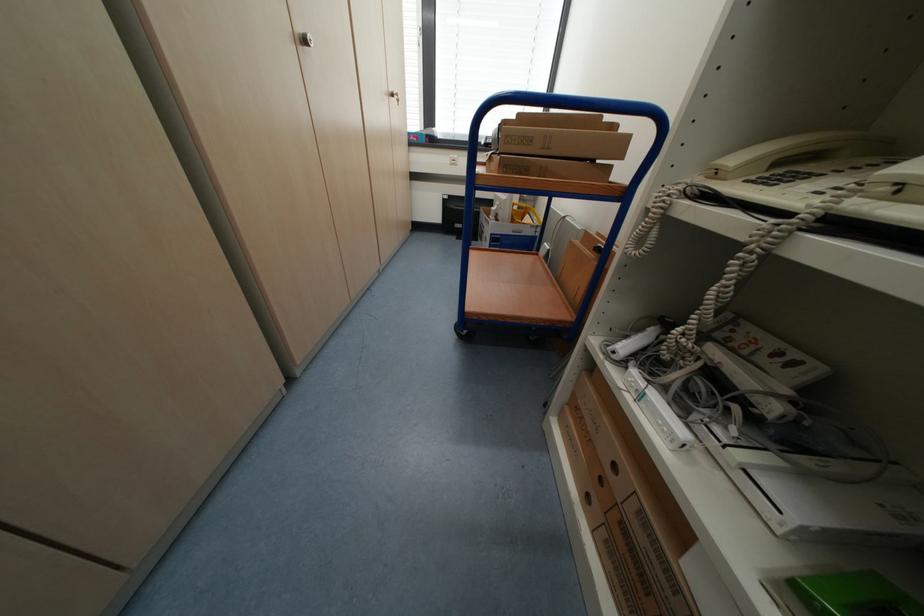
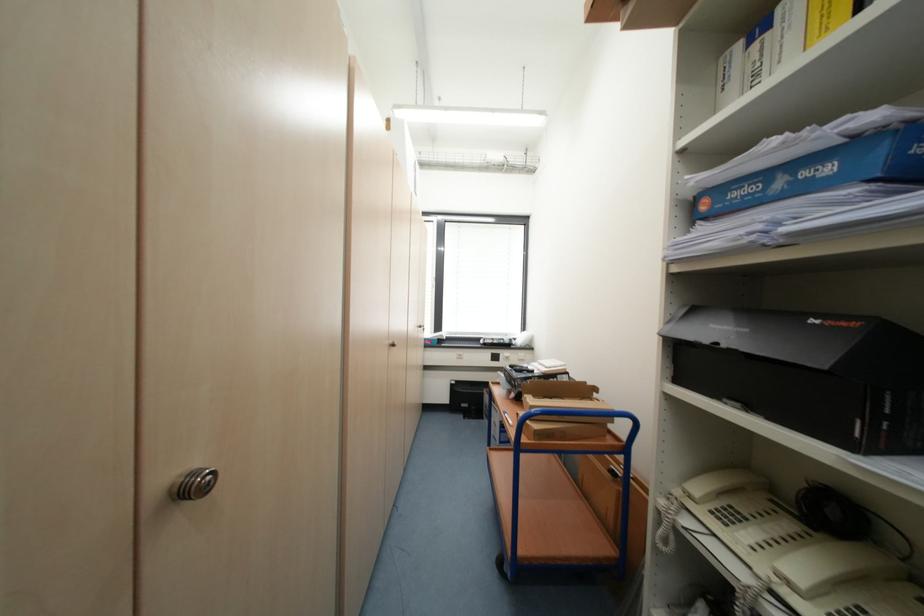
Locate, in the second image, the point that corresponds to (x=723, y=175) in the first image.

(697, 498)